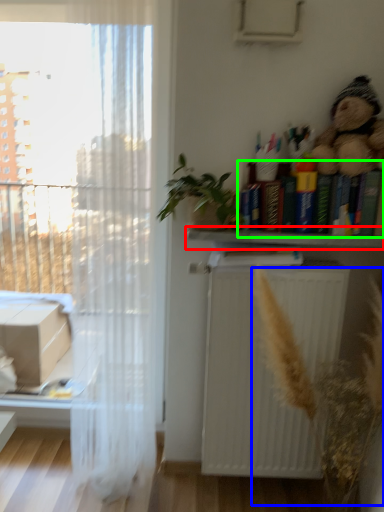
Question: Which is nearer to the shelf (highlighted by a red box)? plant (highlighted by a blue box) or book (highlighted by a green box).

Choices:
 (A) plant
 (B) book

Answer: (B)